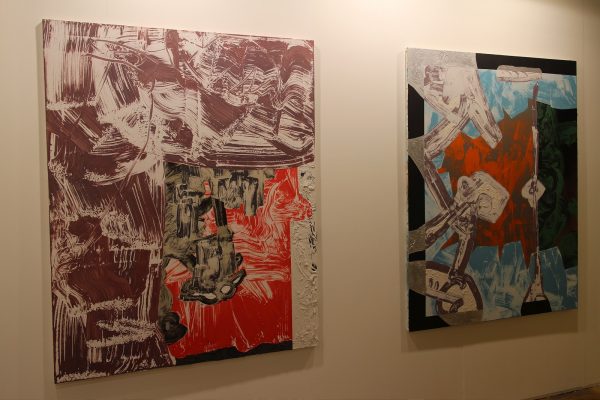
Locate an element on the screen. This screenshot has width=600, height=400. canvas pictures hanging on wall is located at coordinates (211, 150), (488, 215).